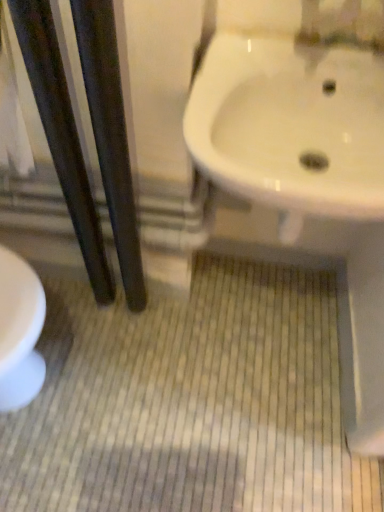
In order to click on free location to the right of black glossy poles at left, which appears as the second pole when viewed from the left in this screenshot , I will do `click(186, 321)`.